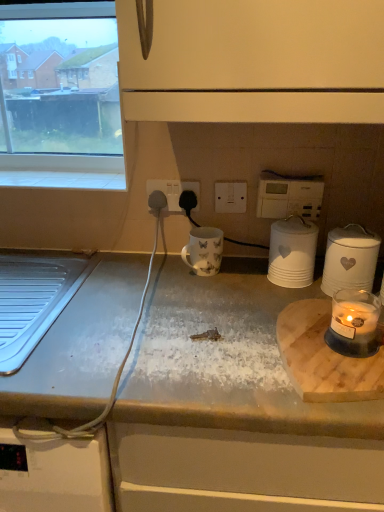
The width and height of the screenshot is (384, 512). I want to click on vacant area located to the right-hand side of white glossy mug at center, so click(251, 276).